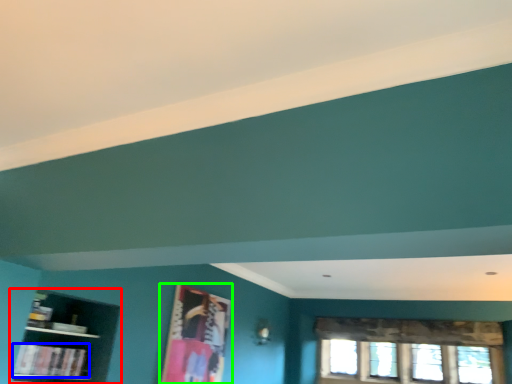
Question: Based on their relative distances, which object is farther from shelf (highlighted by a red box)? Choose from book (highlighted by a blue box) and picture frame (highlighted by a green box).

Choices:
 (A) book
 (B) picture frame

Answer: (B)